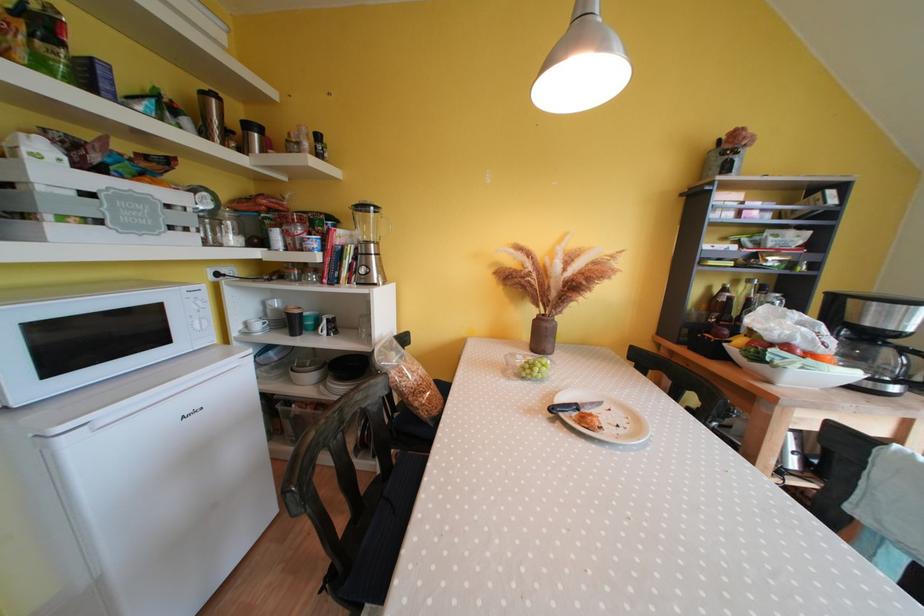
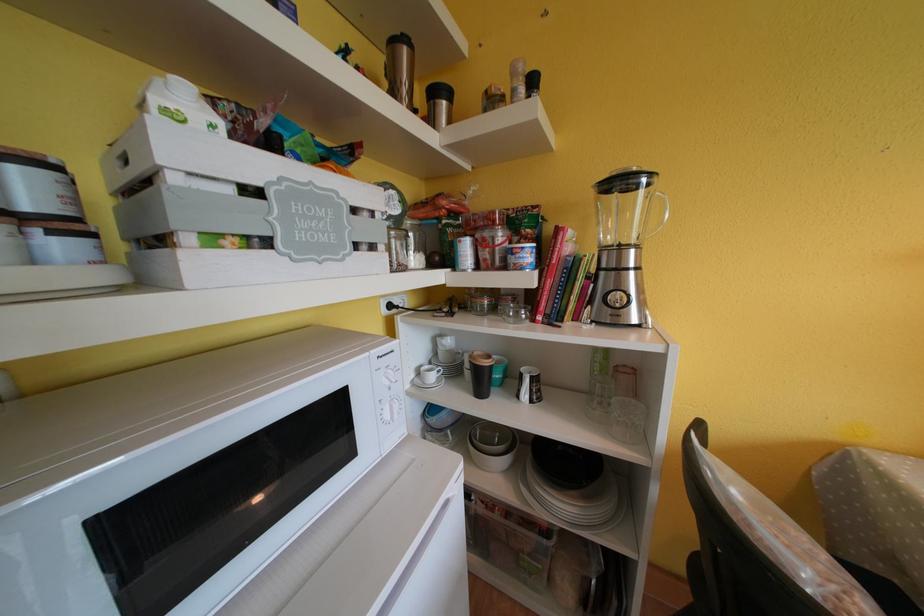
Find the pixel in the second image that matches (x=379, y=249) in the first image.

(638, 254)